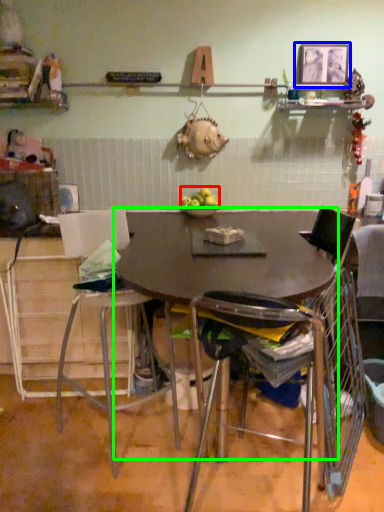
Question: Considering the real-world distances, which object is closest to apple (highlighted by a red box)? picture frame (highlighted by a blue box) or table (highlighted by a green box).

Choices:
 (A) picture frame
 (B) table

Answer: (B)